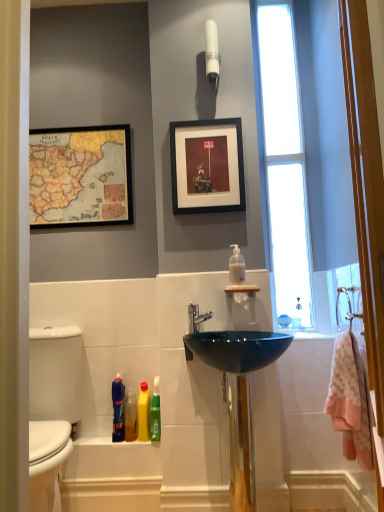
Question: Considering the relative positions of translucent plastic soap dispenser at upper center, marked as the 1th cleaning product in a right-to-left arrangement, and pink cotton bath towel at right in the image provided, is translucent plastic soap dispenser at upper center, marked as the 1th cleaning product in a right-to-left arrangement, to the right of pink cotton bath towel at right from the viewer's perspective?

Choices:
 (A) yes
 (B) no

Answer: (B)

Question: Can you confirm if translucent plastic soap dispenser at upper center, which is the 5th cleaning product in left-to-right order, is smaller than pink cotton bath towel at right?

Choices:
 (A) no
 (B) yes

Answer: (B)

Question: Considering the relative sizes of translucent plastic soap dispenser at upper center, which is the 5th cleaning product in left-to-right order, and pink cotton bath towel at right in the image provided, is translucent plastic soap dispenser at upper center, which is the 5th cleaning product in left-to-right order, taller than pink cotton bath towel at right?

Choices:
 (A) no
 (B) yes

Answer: (A)

Question: Does translucent plastic soap dispenser at upper center, marked as the 1th cleaning product in a right-to-left arrangement, lie in front of pink cotton bath towel at right?

Choices:
 (A) no
 (B) yes

Answer: (A)

Question: From the image's perspective, does translucent plastic soap dispenser at upper center, which is the 5th cleaning product in left-to-right order, appear higher than pink cotton bath towel at right?

Choices:
 (A) no
 (B) yes

Answer: (B)

Question: In terms of height, does white glossy light fixture at upper center look taller or shorter compared to pink cotton bath towel at right?

Choices:
 (A) tall
 (B) short

Answer: (B)

Question: Is white glossy light fixture at upper center bigger or smaller than pink cotton bath towel at right?

Choices:
 (A) small
 (B) big

Answer: (A)

Question: Looking at their shapes, would you say white glossy light fixture at upper center is wider or thinner than pink cotton bath towel at right?

Choices:
 (A) thin
 (B) wide

Answer: (A)

Question: Would you say white glossy light fixture at upper center is inside or outside pink cotton bath towel at right?

Choices:
 (A) inside
 (B) outside

Answer: (B)

Question: From the image's perspective, relative to white glossy toilet at left, is white glossy light fixture at upper center above or below?

Choices:
 (A) above
 (B) below

Answer: (A)

Question: Considering the positions of white glossy light fixture at upper center and white glossy toilet at left in the image, is white glossy light fixture at upper center wider or thinner than white glossy toilet at left?

Choices:
 (A) wide
 (B) thin

Answer: (B)

Question: From a real-world perspective, is white glossy light fixture at upper center above or below white glossy toilet at left?

Choices:
 (A) below
 (B) above

Answer: (B)

Question: Is point [205, 71] positioned closer to the camera than point [48, 337]?

Choices:
 (A) farther
 (B) closer

Answer: (A)

Question: Considering the positions of satin nickel faucet at center and blue glossy bottle at lower left, placed as the 1th cleaning product when sorted from left to right, in the image, is satin nickel faucet at center taller or shorter than blue glossy bottle at lower left, placed as the 1th cleaning product when sorted from left to right,?

Choices:
 (A) tall
 (B) short

Answer: (B)

Question: Looking at their shapes, would you say satin nickel faucet at center is wider or thinner than blue glossy bottle at lower left, placed as the 1th cleaning product when sorted from left to right?

Choices:
 (A) wide
 (B) thin

Answer: (A)